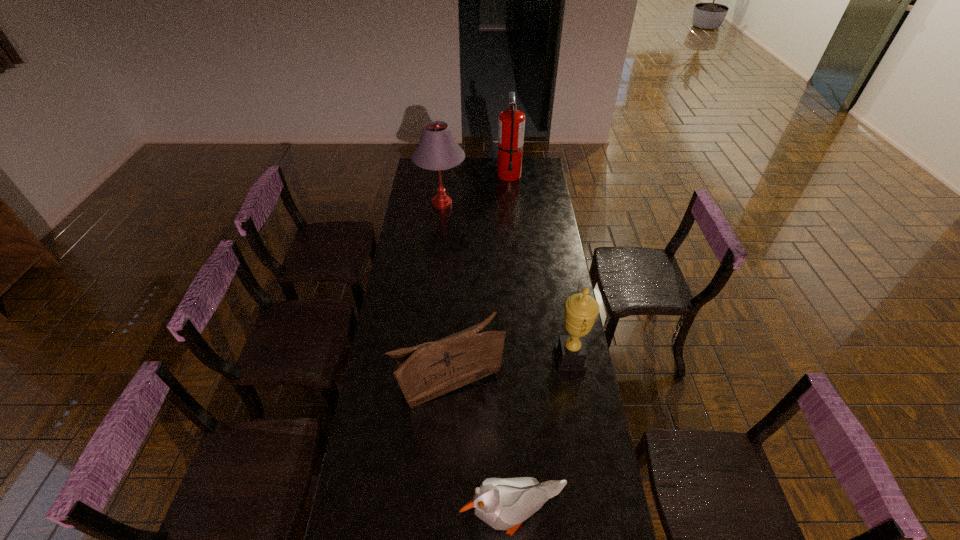
You are a GUI agent. You are given a task and a screenshot of the screen. Output one action in this format:
    pyautogui.click(x=<x>, y=<y>)
    Task: Click on the object positioned at the far edge
    The image size is (960, 540).
    Given the screenshot: What is the action you would take?
    pyautogui.click(x=511, y=125)

Find the location of a particular element. table lamp present at the left edge is located at coordinates (437, 149).

Locate an element on the screen. The width and height of the screenshot is (960, 540). grocery bag at the left edge is located at coordinates (426, 371).

Identify the location of fire extinguisher that is at the right edge. The width and height of the screenshot is (960, 540). (511, 125).

Find the location of `trophy cup that is at the right edge`. trophy cup that is at the right edge is located at coordinates (581, 310).

Where is `object at the far right corner`? This screenshot has width=960, height=540. object at the far right corner is located at coordinates click(x=511, y=125).

You are a GUI agent. You are given a task and a screenshot of the screen. Output one action in this format:
    pyautogui.click(x=<x>, y=<y>)
    Task: Click on the free spot at the far edge of the desktop
    Image resolution: width=960 pixels, height=540 pixels.
    Given the screenshot: What is the action you would take?
    pyautogui.click(x=486, y=172)

The width and height of the screenshot is (960, 540). In the image, there is a desktop. In order to click on free space at the left edge in this screenshot , I will do `click(396, 496)`.

Find the location of `vacant area at the right edge of the desktop`. vacant area at the right edge of the desktop is located at coordinates (572, 518).

You are a GUI agent. You are given a task and a screenshot of the screen. Output one action in this format:
    pyautogui.click(x=<x>, y=<y>)
    Task: Click on the blank region between the grocery bag and the second farthest object
    This screenshot has width=960, height=540.
    Given the screenshot: What is the action you would take?
    click(444, 295)